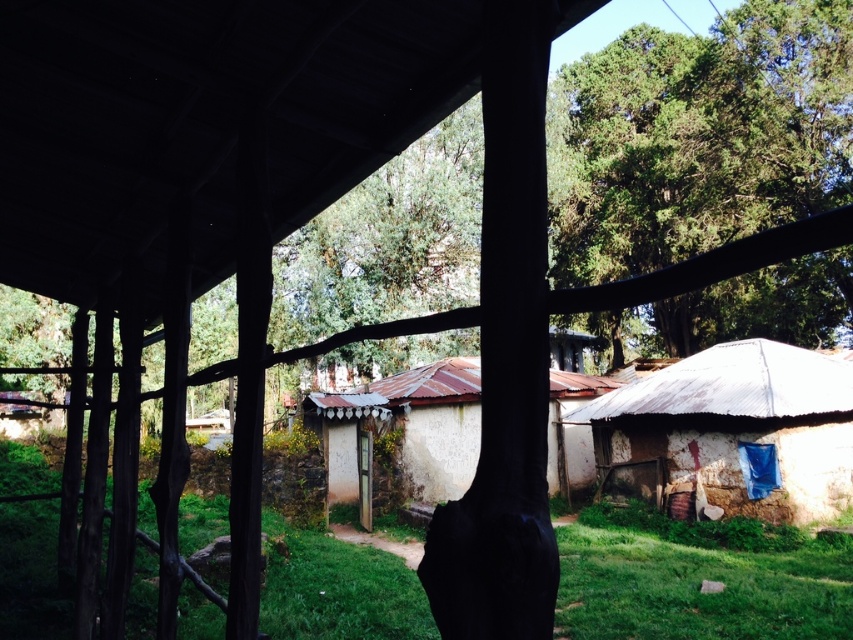
Question: Does white corrugated metal hut at lower right have a greater width compared to white matte hut at center?

Choices:
 (A) no
 (B) yes

Answer: (A)

Question: Does green grass at lower center appear over white matte hut at center?

Choices:
 (A) no
 (B) yes

Answer: (A)

Question: Which of the following is the farthest from the observer?

Choices:
 (A) white corrugated metal hut at lower right
 (B) white matte hut at center
 (C) green grass at lower center
 (D) green leafy tree at upper center

Answer: (D)

Question: Is green grass at lower center further to camera compared to white corrugated metal hut at lower right?

Choices:
 (A) yes
 (B) no

Answer: (B)

Question: Estimate the real-world distances between objects in this image. Which object is closer to the white corrugated metal hut at lower right?

Choices:
 (A) green grass at lower center
 (B) white matte hut at center
 (C) green leafy tree at upper center

Answer: (B)

Question: Estimate the real-world distances between objects in this image. Which object is closer to the white matte hut at center?

Choices:
 (A) white corrugated metal hut at lower right
 (B) green leafy tree at upper center
 (C) green grass at lower center

Answer: (C)